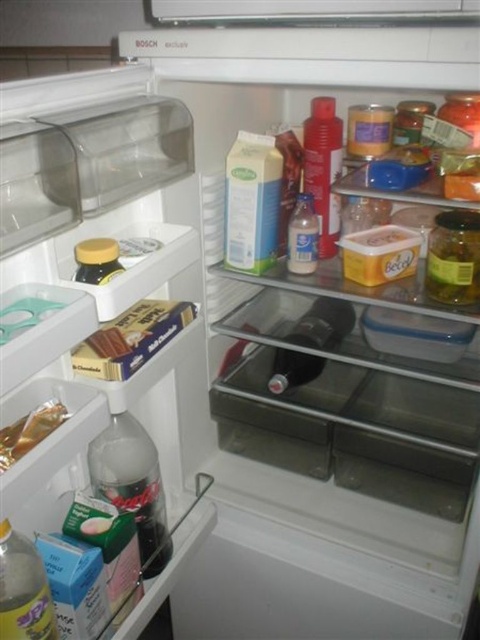
Measure the distance between point (132, 419) and camera.

Point (132, 419) and camera are 32.49 inches apart.

Does point (140, 504) come in front of point (467, 228)?

Yes, it is.

Describe the element at coordinates (132, 484) in the screenshot. The height and width of the screenshot is (640, 480). I see `clear plastic bottle at lower left` at that location.

Identify the location of clear plastic bottle at lower left. (132, 484).

Does gold foil packet at lower left have a greater height compared to translucent plastic bottle at center?

In fact, gold foil packet at lower left may be shorter than translucent plastic bottle at center.

Which is above, gold foil packet at lower left or translucent plastic bottle at center?

translucent plastic bottle at center is higher up.

Find the location of a particular element. This screenshot has width=480, height=640. gold foil packet at lower left is located at coordinates (29, 432).

Is green glass jar at upper right shorter than black matte bottle at center?

Yes.

The height and width of the screenshot is (640, 480). Identify the location of green glass jar at upper right. (454, 257).

This screenshot has width=480, height=640. I want to click on green glass jar at upper right, so (x=454, y=257).